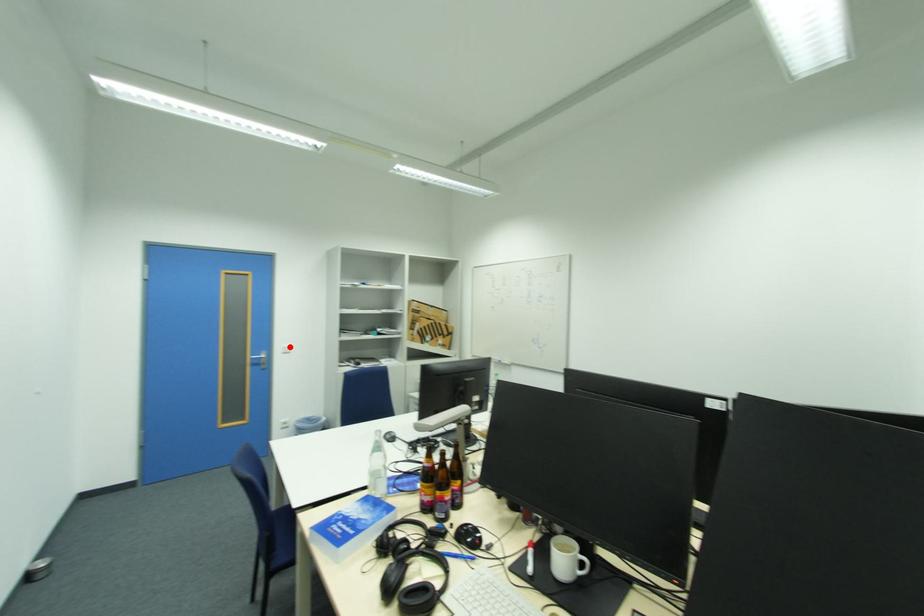
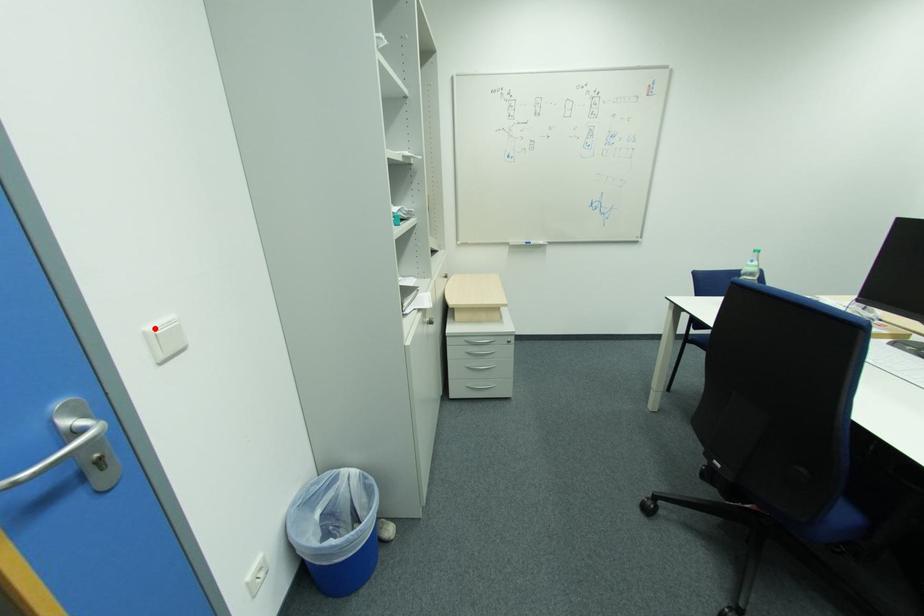
I am providing you with two images of the same scene from different viewpoints. A red point is marked on the first image and another point is marked on the second image. Do the highlighted points in image1 and image2 indicate the same real-world spot?

Yes